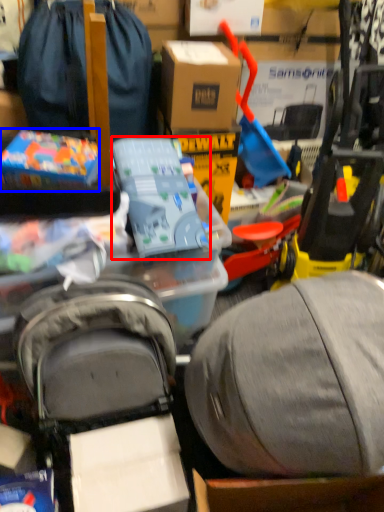
Question: Which of the following is the closest to the observer, toy (highlighted by a red box) or toy (highlighted by a blue box)?

Choices:
 (A) toy
 (B) toy

Answer: (A)